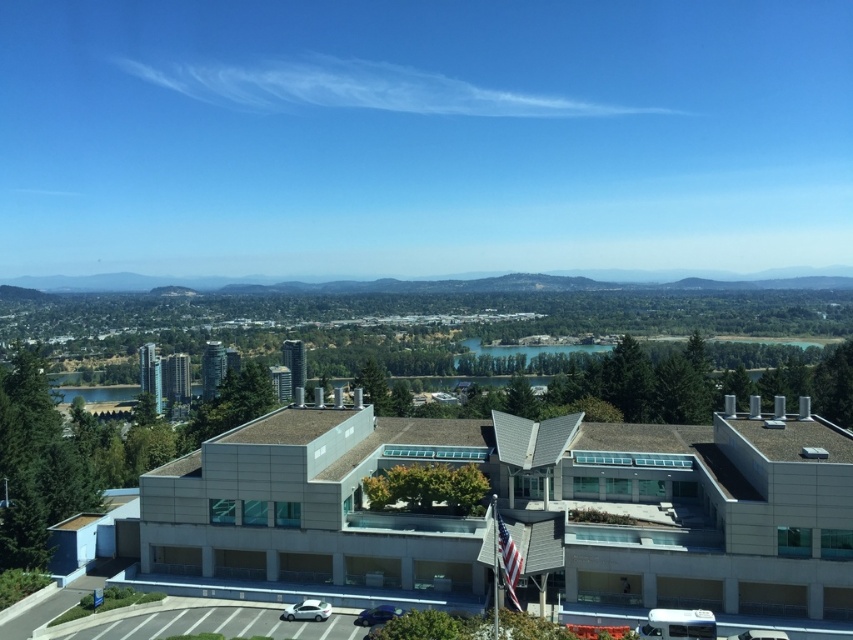
From the picture: Is white glossy sedan at center above shiny blue sedan at lower center?

Yes, white glossy sedan at center is above shiny blue sedan at lower center.

Does white glossy sedan at center come in front of shiny blue sedan at lower center?

No, white glossy sedan at center is behind shiny blue sedan at lower center.

This screenshot has height=640, width=853. I want to click on white glossy sedan at center, so click(306, 611).